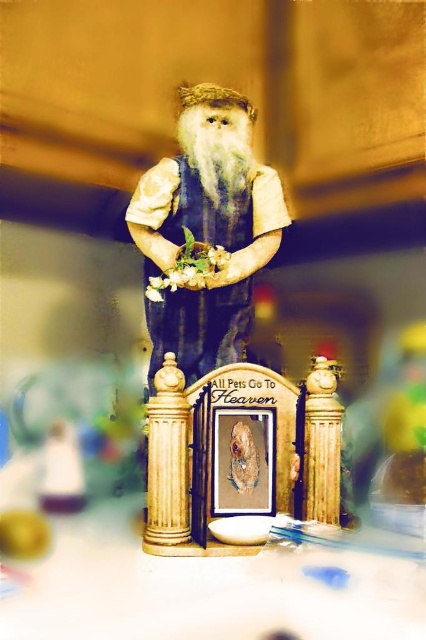
Can you confirm if matte brown figurine at center is thinner than white fluffy beard at center?

Incorrect, matte brown figurine at center's width is not less than white fluffy beard at center's.

Does matte brown figurine at center appear over white fluffy beard at center?

No, matte brown figurine at center is not above white fluffy beard at center.

Measure the distance between point [256,266] and camera.

Point [256,266] and camera are 5.85 feet apart.

Where is `matte brown figurine at center`? matte brown figurine at center is located at coordinates (207, 228).